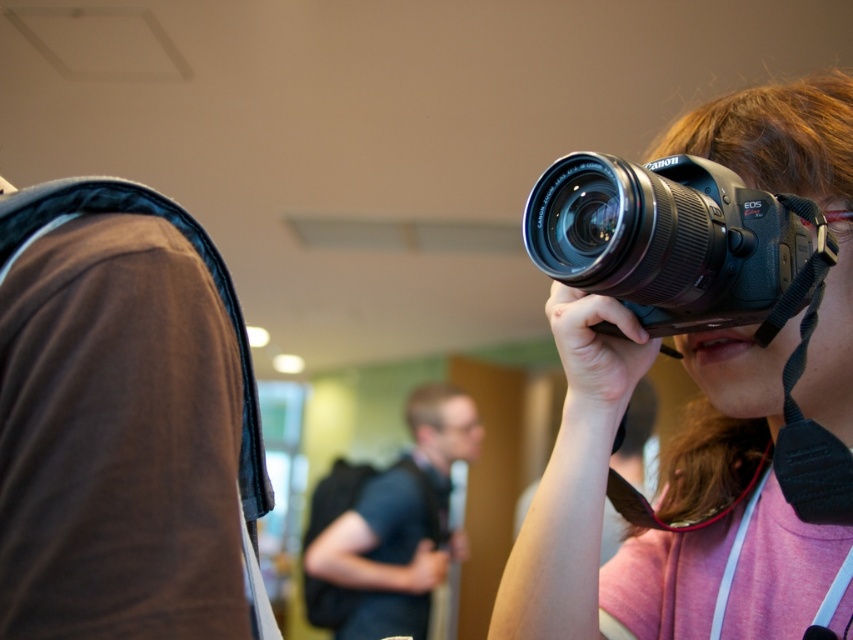
Question: Can you confirm if black plastic camera at upper right is bigger than black matte shirt at center?

Choices:
 (A) yes
 (B) no

Answer: (B)

Question: Which of the following is the farthest from the observer?

Choices:
 (A) black matte shirt at center
 (B) matte black camera at upper right

Answer: (A)

Question: Which of these objects is positioned farthest from the black plastic camera at upper right?

Choices:
 (A) matte black camera at upper right
 (B) black matte shirt at center

Answer: (B)

Question: Considering the real-world distances, which object is farthest from the black matte shirt at center?

Choices:
 (A) black plastic camera at upper right
 (B) matte black camera at upper right

Answer: (A)

Question: From the image, what is the correct spatial relationship of black plastic camera at upper right in relation to black matte shirt at center?

Choices:
 (A) below
 (B) above

Answer: (B)

Question: Is matte black camera at upper right above black plastic camera at upper right?

Choices:
 (A) no
 (B) yes

Answer: (A)